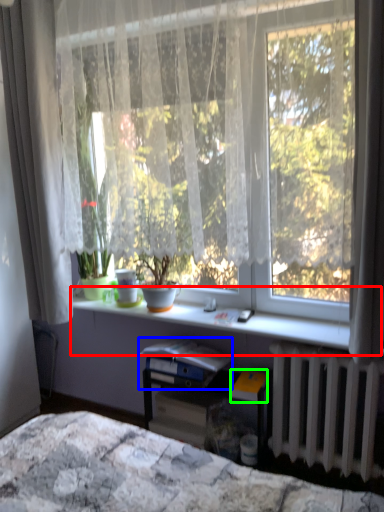
Question: Which is nearer to the window sill (highlighted by a red box)? paperback book (highlighted by a blue box) or paperback book (highlighted by a green box).

Choices:
 (A) paperback book
 (B) paperback book

Answer: (A)